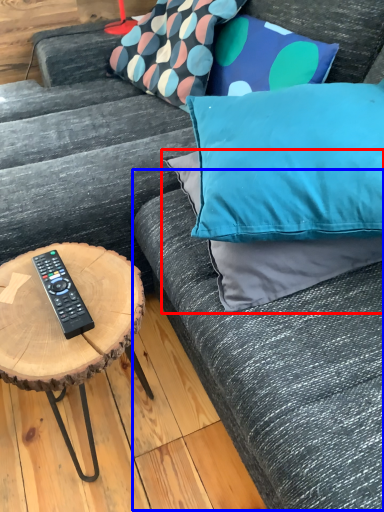
Question: Which of the following is the closest to the observer, pillow (highlighted by a red box) or couch (highlighted by a blue box)?

Choices:
 (A) pillow
 (B) couch

Answer: (B)